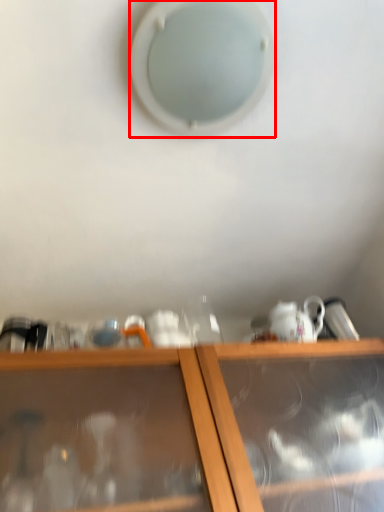
Question: In this image, where is hole (annotated by the red box) located relative to shelf?

Choices:
 (A) left
 (B) right

Answer: (A)